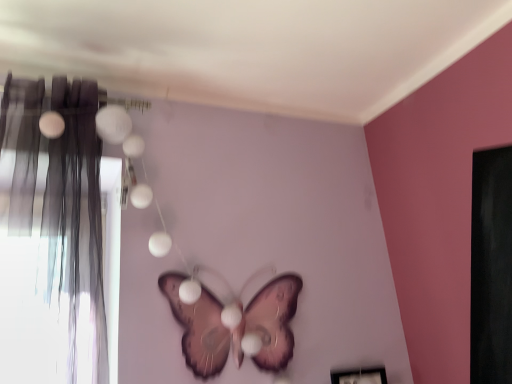
You are a GUI agent. You are given a task and a screenshot of the screen. Output one action in this format:
    pyautogui.click(x=<x>, y=<y>)
    Task: Click on the matte gray curtain at left
    This screenshot has height=384, width=512.
    Given the screenshot: What is the action you would take?
    pyautogui.click(x=57, y=239)

This screenshot has width=512, height=384. What do you see at coordinates (57, 239) in the screenshot?
I see `matte gray curtain at left` at bounding box center [57, 239].

Describe the element at coordinates (237, 327) in the screenshot. The height and width of the screenshot is (384, 512). I see `pink matte butterfly at center` at that location.

Measure the distance between point (283, 304) and camera.

Point (283, 304) is 4.40 feet from camera.

This screenshot has height=384, width=512. Identify the location of pink matte butterfly at center. (237, 327).

What are the coordinates of `matte gray curtain at left` in the screenshot? It's located at (57, 239).

Considering the relative positions of matte gray curtain at left and pink matte butterfly at center in the image provided, is matte gray curtain at left to the right of pink matte butterfly at center from the viewer's perspective?

No.

Considering the positions of objects matte gray curtain at left and pink matte butterfly at center in the image provided, who is behind, matte gray curtain at left or pink matte butterfly at center?

pink matte butterfly at center is further away from the camera.

Between point (70, 235) and point (210, 324), which one is positioned behind?

Point (210, 324)

From the image's perspective, which one is positioned higher, matte gray curtain at left or pink matte butterfly at center?

matte gray curtain at left is shown above in the image.

From a real-world perspective, is matte gray curtain at left physically located above or below pink matte butterfly at center?

Clearly, from a real-world perspective, matte gray curtain at left is above pink matte butterfly at center.

Can you confirm if matte gray curtain at left is thinner than pink matte butterfly at center?

No, matte gray curtain at left is not thinner than pink matte butterfly at center.

Does matte gray curtain at left have a lesser height compared to pink matte butterfly at center?

No.

Considering the relative sizes of matte gray curtain at left and pink matte butterfly at center in the image provided, is matte gray curtain at left smaller than pink matte butterfly at center?

No, matte gray curtain at left is not smaller than pink matte butterfly at center.

Would you say matte gray curtain at left contains pink matte butterfly at center?

No, pink matte butterfly at center is not surrounded by matte gray curtain at left.

Is the surface of matte gray curtain at left in direct contact with pink matte butterfly at center?

There is a gap between matte gray curtain at left and pink matte butterfly at center.

Is matte gray curtain at left facing away from pink matte butterfly at center?

No, matte gray curtain at left is not facing the opposite direction of pink matte butterfly at center.

How far apart are matte gray curtain at left and pink matte butterfly at center?

The distance of matte gray curtain at left from pink matte butterfly at center is 35.72 centimeters.

This screenshot has height=384, width=512. In order to click on butterfly behind the matte gray curtain at left in this screenshot , I will do `click(237, 327)`.

In the scene shown: Between pink matte butterfly at center and matte gray curtain at left, which one appears on the left side from the viewer's perspective?

Positioned to the left is matte gray curtain at left.

Is pink matte butterfly at center positioned in front of matte gray curtain at left?

No, pink matte butterfly at center is further to the viewer.

Does point (278, 365) appear closer or farther from the camera than point (59, 200)?

Point (278, 365) is farther from the camera than point (59, 200).

Based on the photo, from the image's perspective, is pink matte butterfly at center above or below matte gray curtain at left?

pink matte butterfly at center is below matte gray curtain at left.

From a real-world perspective, who is located higher, pink matte butterfly at center or matte gray curtain at left?

From a 3D spatial view, matte gray curtain at left is above.

Between pink matte butterfly at center and matte gray curtain at left, which one has smaller width?

pink matte butterfly at center.

Considering the sizes of objects pink matte butterfly at center and matte gray curtain at left in the image provided, who is taller, pink matte butterfly at center or matte gray curtain at left?

Standing taller between the two is matte gray curtain at left.

Between pink matte butterfly at center and matte gray curtain at left, which one has larger size?

matte gray curtain at left is bigger.

Do you think pink matte butterfly at center is within matte gray curtain at left, or outside of it?

pink matte butterfly at center is not inside matte gray curtain at left, it's outside.

Is pink matte butterfly at center touching matte gray curtain at left?

No, pink matte butterfly at center is not beside matte gray curtain at left.

Does pink matte butterfly at center turn towards matte gray curtain at left?

No, pink matte butterfly at center is not turned towards matte gray curtain at left.

Can you tell me how much pink matte butterfly at center and matte gray curtain at left differ in facing direction?

They differ by 1.45 degrees in their facing directions.

Locate an element on the screen. curtain above the pink matte butterfly at center (from the image's perspective) is located at coordinates (57, 239).

Find the location of a particular element. The height and width of the screenshot is (384, 512). butterfly on the right of the matte gray curtain at left is located at coordinates (237, 327).

You are a GUI agent. You are given a task and a screenshot of the screen. Output one action in this format:
    pyautogui.click(x=<x>, y=<y>)
    Task: Click on the curtain above the pink matte butterfly at center (from the image's perspective)
    
    Given the screenshot: What is the action you would take?
    pyautogui.click(x=57, y=239)